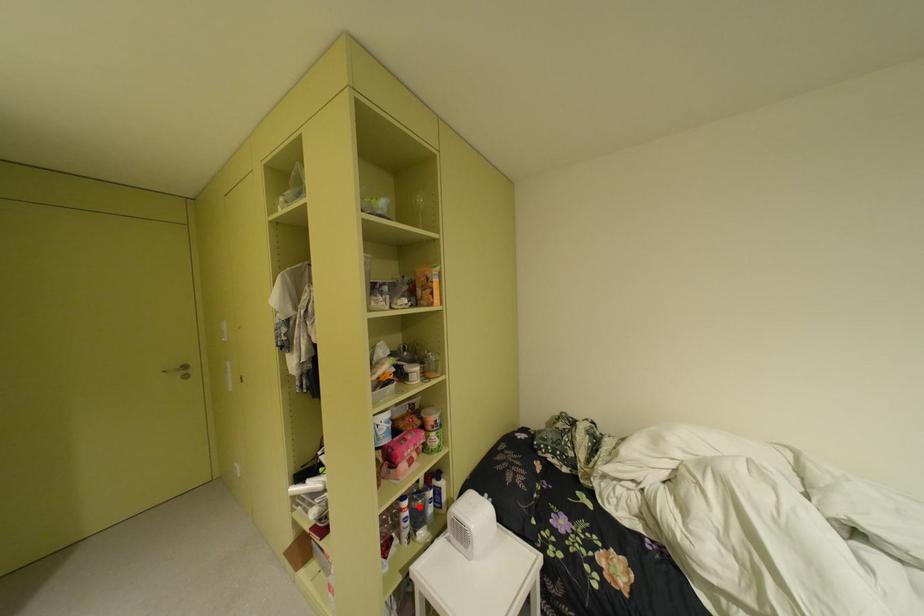
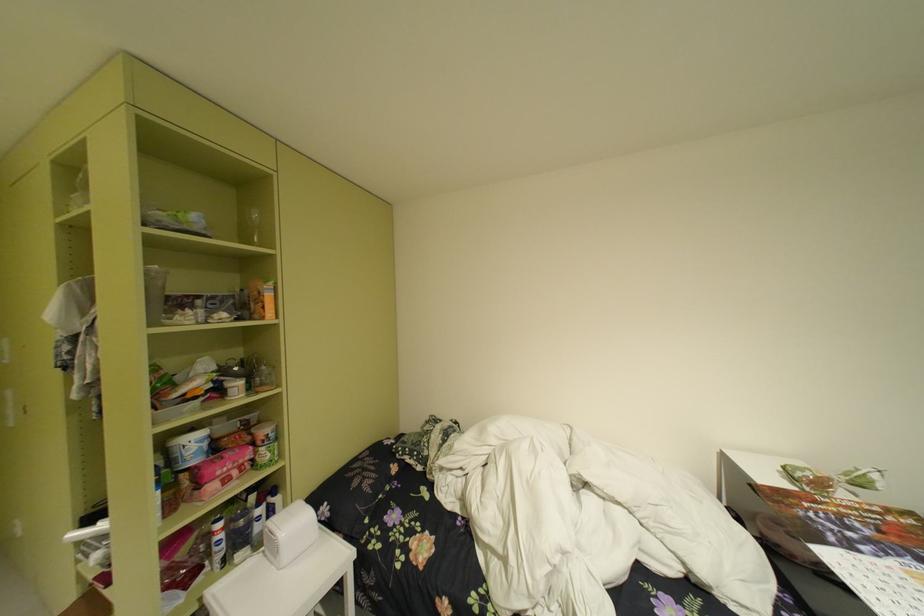
Question: I am providing you with two images of the same scene from different viewpoints. A red point is shown in image1. For the corresponding object point in image2, is it positioned nearer or farther from the camera?

Choices:
 (A) Nearer
 (B) Farther

Answer: (A)